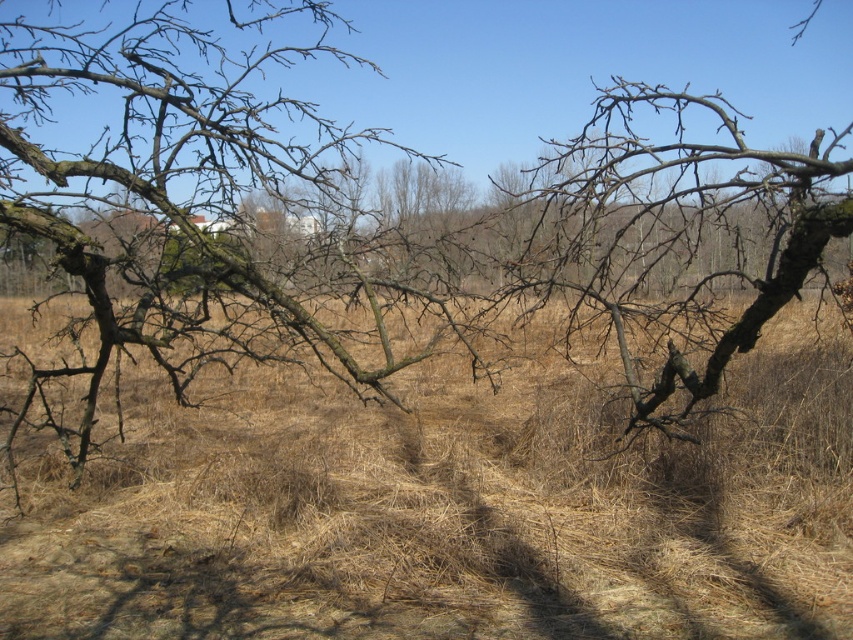
You are standing at the camera position in the image. There is a point at coordinates point (564, 550). Can you reach this point without moving your feet?

The point at coordinates point 0.862, 0.662 is 14.23 feet away from the camera. Since you are standing at the camera position, you cannot reach this point without moving your feet because it is too far away.

You are standing in the middle of a tree with branches around you. You see a point marked at coordinates (445, 512). What is located at that point?

The point at coordinates (445, 512) indicates brown dry grass at center.